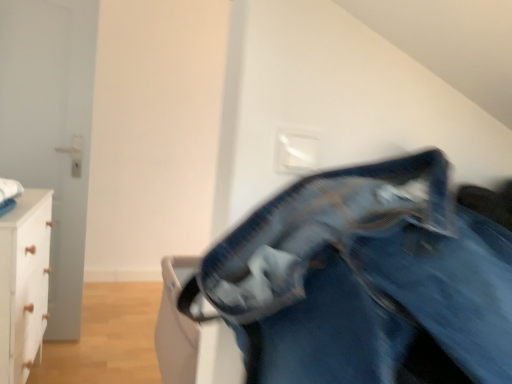
Question: Is denim pants at center situated inside white matte chest of drawers at left or outside?

Choices:
 (A) outside
 (B) inside

Answer: (A)

Question: Is denim pants at center in front of or behind white matte chest of drawers at left in the image?

Choices:
 (A) behind
 (B) front

Answer: (B)

Question: Is denim pants at center to the left or to the right of white matte chest of drawers at left in the image?

Choices:
 (A) left
 (B) right

Answer: (B)

Question: Considering the positions of white matte chest of drawers at left and denim pants at center in the image, is white matte chest of drawers at left taller or shorter than denim pants at center?

Choices:
 (A) tall
 (B) short

Answer: (A)

Question: From a real-world perspective, relative to denim pants at center, is white matte chest of drawers at left vertically above or below?

Choices:
 (A) below
 (B) above

Answer: (A)

Question: Based on their sizes in the image, would you say white matte chest of drawers at left is bigger or smaller than denim pants at center?

Choices:
 (A) small
 (B) big

Answer: (B)

Question: Considering the positions of point (41, 294) and point (437, 246), is point (41, 294) closer or farther from the camera than point (437, 246)?

Choices:
 (A) closer
 (B) farther

Answer: (B)